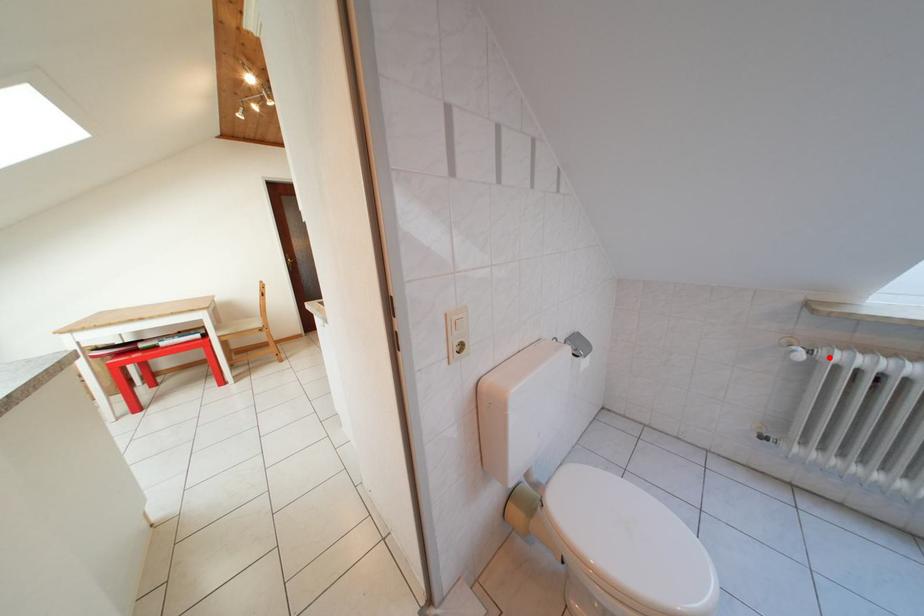
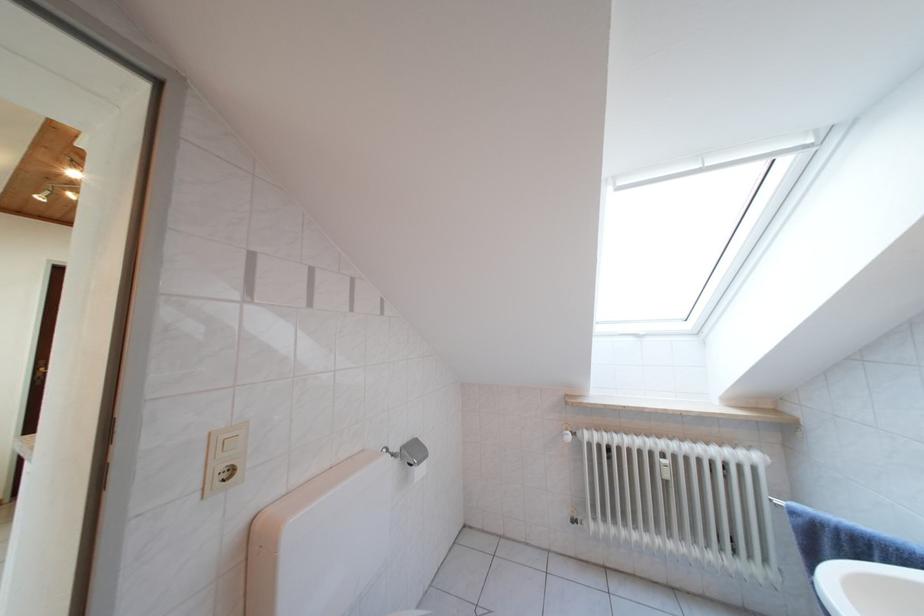
Locate, in the second image, the point that corresponds to the highlighted location in the first image.

(588, 439)